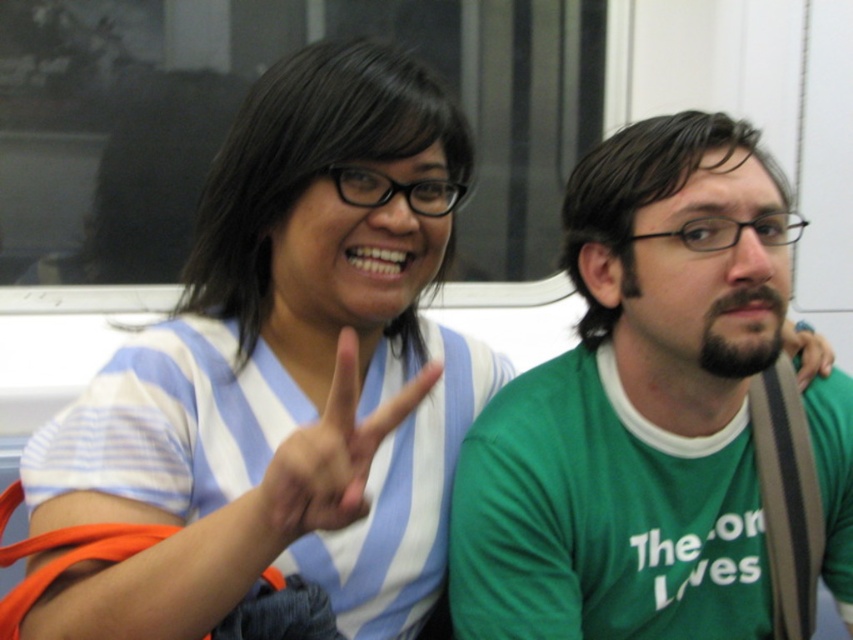
Question: Is blue striped shirt at upper left to the right of white matte hand at center from the viewer's perspective?

Choices:
 (A) yes
 (B) no

Answer: (B)

Question: Is white matte hand at center smaller than green fabric hand at right?

Choices:
 (A) no
 (B) yes

Answer: (A)

Question: Which point is closer to the camera?

Choices:
 (A) (285, 454)
 (B) (126, 516)
 (C) (694, 273)
 (D) (802, 369)

Answer: (A)

Question: Among these points, which one is farthest from the camera?

Choices:
 (A) (500, 433)
 (B) (250, 525)
 (C) (822, 353)

Answer: (C)

Question: Is white matte hand at center to the left of green fabric hand at right from the viewer's perspective?

Choices:
 (A) no
 (B) yes

Answer: (B)

Question: Which point appears closest to the camera in this image?

Choices:
 (A) pos(291,481)
 (B) pos(811,372)
 (C) pos(164,452)

Answer: (A)